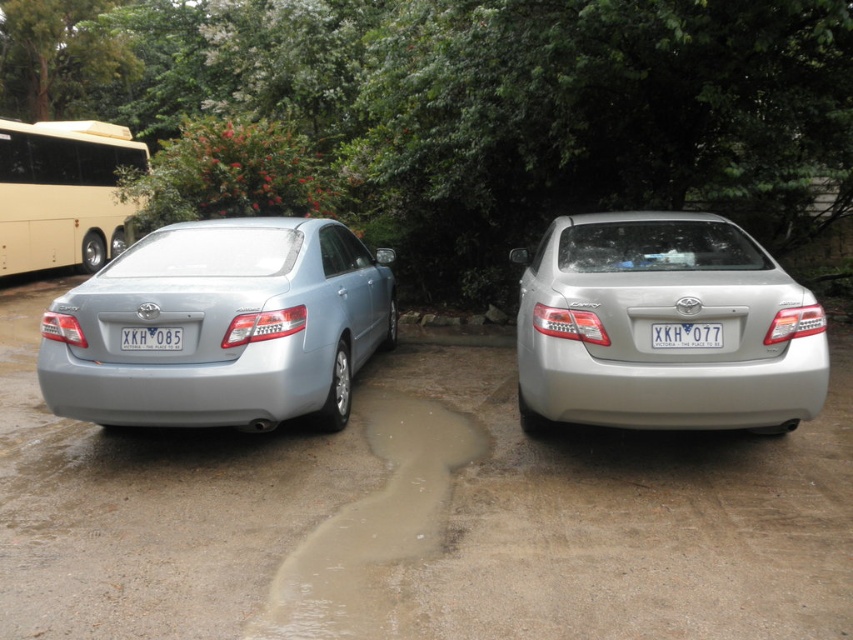
Does satin silver sedan at right have a lesser height compared to white plastic license plate at center?

No, satin silver sedan at right is not shorter than white plastic license plate at center.

Is satin silver sedan at right bigger than white plastic license plate at center?

Yes.

Image resolution: width=853 pixels, height=640 pixels. Describe the element at coordinates (663, 321) in the screenshot. I see `satin silver sedan at right` at that location.

At what (x,y) coordinates should I click in order to perform the action: click on satin silver sedan at right. Please return your answer as a coordinate pair (x, y). This screenshot has height=640, width=853. Looking at the image, I should click on (663, 321).

Can you confirm if brown/clay-like puddle at lower center is positioned to the right of beige metallic bus at left?

Indeed, brown/clay-like puddle at lower center is positioned on the right side of beige metallic bus at left.

Between brown/clay-like puddle at lower center and beige metallic bus at left, which one appears on the left side from the viewer's perspective?

Positioned to the left is beige metallic bus at left.

Where is `brown/clay-like puddle at lower center`? The width and height of the screenshot is (853, 640). brown/clay-like puddle at lower center is located at coordinates (373, 524).

Where is `brown/clay-like puddle at lower center`? This screenshot has height=640, width=853. brown/clay-like puddle at lower center is located at coordinates coord(373,524).

Which of these two, white plastic license plate at center or white plastic license plate at left, stands shorter?

white plastic license plate at left is shorter.

Is point (705, 326) closer to camera compared to point (178, 332)?

That is True.

At what (x,y) coordinates should I click in order to perform the action: click on white plastic license plate at center. Please return your answer as a coordinate pair (x, y). This screenshot has width=853, height=640. Looking at the image, I should click on (685, 336).

This screenshot has height=640, width=853. In order to click on white plastic license plate at center in this screenshot , I will do `click(685, 336)`.